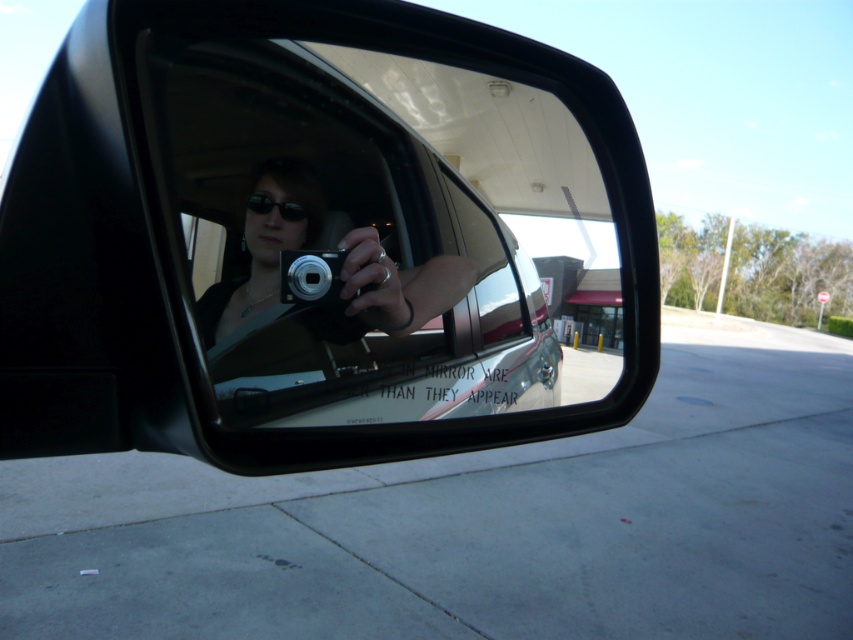
You are a photographer trying to decide which camera to use for a shoot. You see both the matte black camera at center and the silver metallic camera at center in the reflection. Which camera is positioned to the right side in the mirror?

The matte black camera at center is positioned to the right of the silver metallic camera at center in the mirror.

You are inside a car and want to take a photo of the gas station outside using the silver metallic camera at center. However, you notice that the transparent glass car window at center might block your view. Based on their positions, can you determine if the camera can capture the gas station through the window?

The transparent glass car window at center is located below the silver metallic camera at center, so the camera is positioned above the window. This means the camera can capture the gas station outside through the transparent glass car window at center since it is not blocked by the window itself.

You are a photographer trying to capture a clear image of the gas station outside through the transparent glass car window at center and the matte black camera at center. Which object would allow you to see the gas station more clearly?

The transparent glass car window at center is much taller than the matte black camera at center, so it would provide a clearer view of the gas station outside.